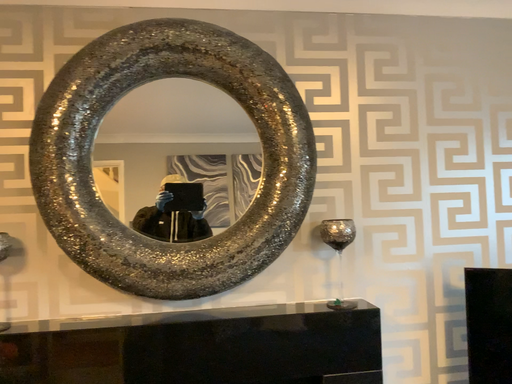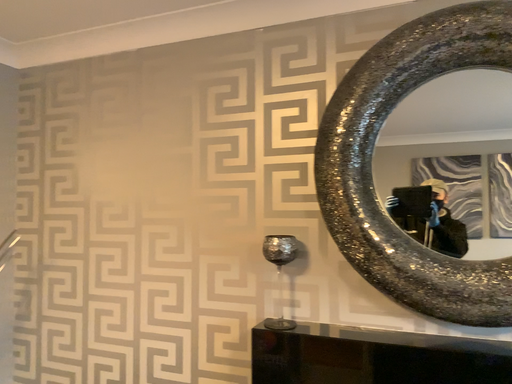
Question: How did the camera likely rotate when shooting the video?

Choices:
 (A) rotated right
 (B) rotated left

Answer: (B)